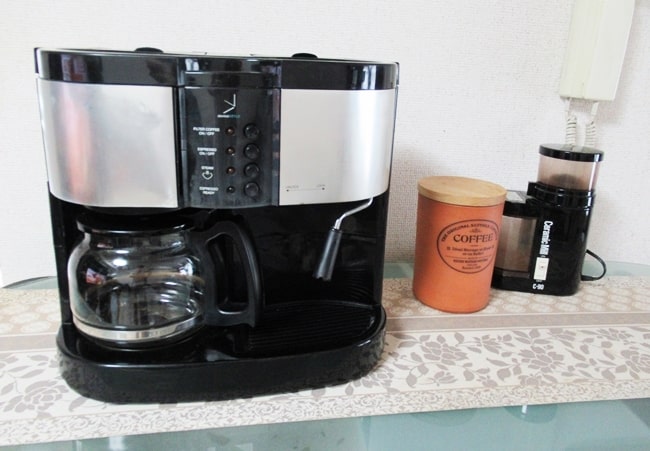
This screenshot has width=650, height=451. I want to click on coffee pot handle, so click(x=251, y=276).